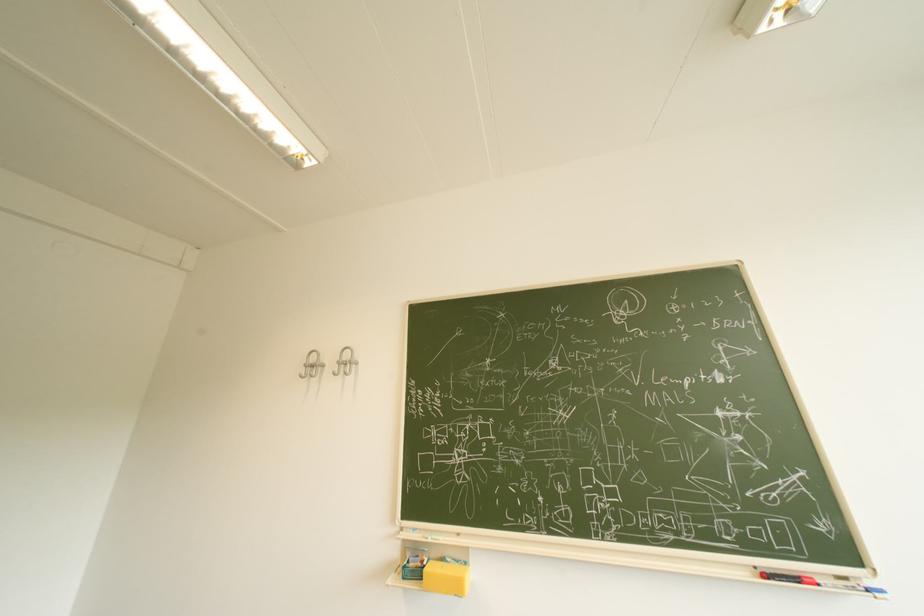
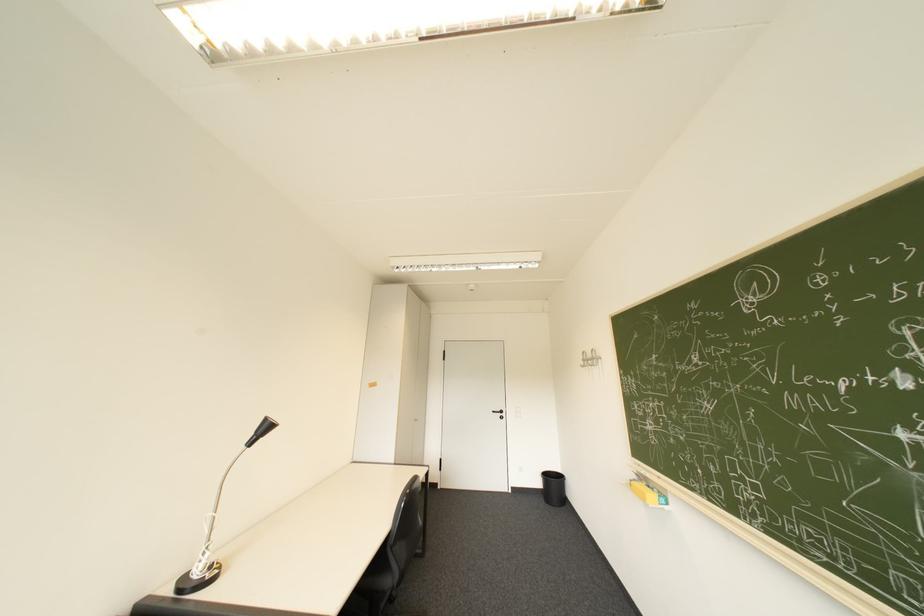
Locate, in the second image, the point that corresponds to [312,371] in the first image.

(591, 363)